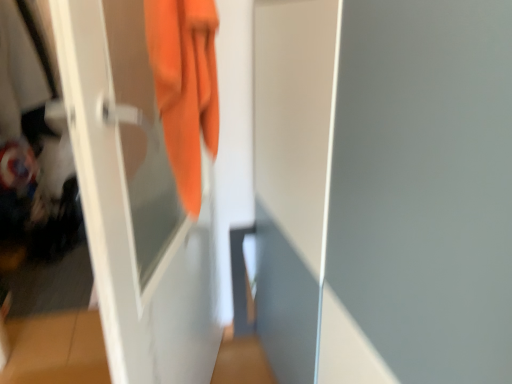
Question: Can you confirm if orange fabric towel at upper left is wider than white glossy screen door at center, the second screen door in the left-to-right sequence?

Choices:
 (A) no
 (B) yes

Answer: (A)

Question: Is orange fabric towel at upper left beside white glossy screen door at center, the second screen door in the left-to-right sequence?

Choices:
 (A) no
 (B) yes

Answer: (A)

Question: Is orange fabric towel at upper left bigger than white glossy screen door at center, which is counted as the first screen door, starting from the right?

Choices:
 (A) yes
 (B) no

Answer: (B)

Question: Does orange fabric towel at upper left have a greater height compared to white glossy screen door at center, which is counted as the first screen door, starting from the right?

Choices:
 (A) no
 (B) yes

Answer: (A)

Question: Could you tell me if orange fabric towel at upper left is turned towards white glossy screen door at center, which is counted as the first screen door, starting from the right?

Choices:
 (A) yes
 (B) no

Answer: (A)

Question: Is white glossy screen door at center, which is counted as the first screen door, starting from the right, spatially inside white glossy screen door at left, which is counted as the 1th screen door, starting from the left, or outside of it?

Choices:
 (A) inside
 (B) outside

Answer: (B)

Question: In the image, is white glossy screen door at center, the second screen door in the left-to-right sequence, positioned in front of or behind white glossy screen door at left, which ranks as the second screen door in right-to-left order?

Choices:
 (A) behind
 (B) front

Answer: (B)

Question: Considering the positions of point (382, 274) and point (106, 246), is point (382, 274) closer or farther from the camera than point (106, 246)?

Choices:
 (A) closer
 (B) farther

Answer: (B)

Question: From a real-world perspective, is white glossy screen door at center, which is counted as the first screen door, starting from the right, positioned above or below white glossy screen door at left, which ranks as the second screen door in right-to-left order?

Choices:
 (A) below
 (B) above

Answer: (A)

Question: From the image's perspective, is orange fabric towel at upper left located above or below white glossy screen door at left, which ranks as the second screen door in right-to-left order?

Choices:
 (A) below
 (B) above

Answer: (B)

Question: Is orange fabric towel at upper left in front of or behind white glossy screen door at left, which is counted as the 1th screen door, starting from the left, in the image?

Choices:
 (A) behind
 (B) front

Answer: (A)

Question: Does point (176, 102) appear closer or farther from the camera than point (194, 327)?

Choices:
 (A) closer
 (B) farther

Answer: (A)

Question: Is orange fabric towel at upper left inside or outside of white glossy screen door at left, which is counted as the 1th screen door, starting from the left?

Choices:
 (A) inside
 (B) outside

Answer: (A)

Question: From the image's perspective, is white glossy screen door at left, which is counted as the 1th screen door, starting from the left, located above or below orange fabric towel at upper left?

Choices:
 (A) below
 (B) above

Answer: (A)

Question: Considering their positions, is white glossy screen door at left, which is counted as the 1th screen door, starting from the left, located in front of or behind orange fabric towel at upper left?

Choices:
 (A) behind
 (B) front

Answer: (B)